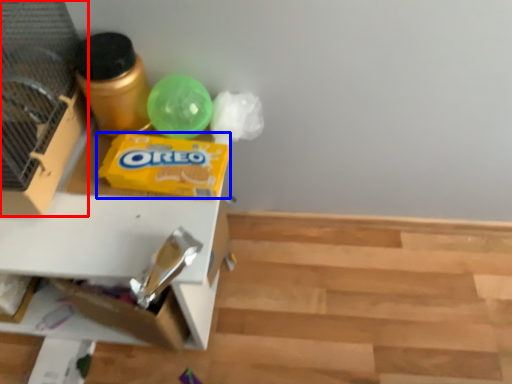
Question: Which point is closer to the camera, bird cage (highlighted by a red box) or waste (highlighted by a blue box)?

Choices:
 (A) bird cage
 (B) waste

Answer: (A)